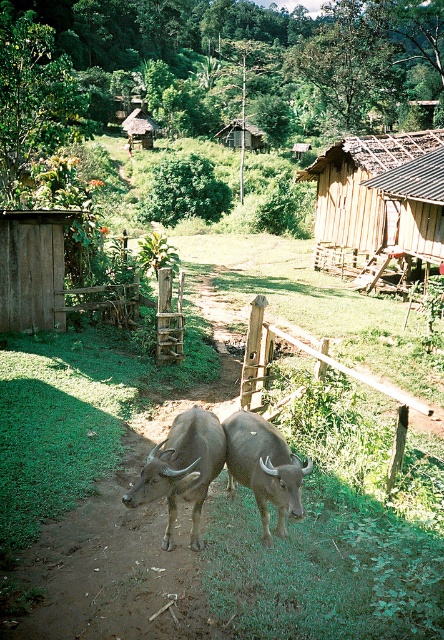
Question: Which of these objects is positioned closest to the dark brown textured cow at center?

Choices:
 (A) wooden hut at center
 (B) wooden hut at upper right

Answer: (B)

Question: Which point is farther to the camera?

Choices:
 (A) brown rough textured buffalo at center
 (B) wooden hut at upper right
 (C) wooden thatched hut at upper center
 (D) wooden fence at center

Answer: (C)

Question: Which point is farther to the camera?

Choices:
 (A) wooden thatched hut at upper center
 (B) wooden fence at left
 (C) dark brown textured cow at center

Answer: (A)

Question: Is wooden hut at upper right positioned behind wooden thatched hut at upper center?

Choices:
 (A) no
 (B) yes

Answer: (A)

Question: Does wooden hut at upper right lie in front of dark brown textured cow at center?

Choices:
 (A) no
 (B) yes

Answer: (A)

Question: Where is wooden hut at upper right located in relation to wooden thatched hut at upper center in the image?

Choices:
 (A) left
 (B) right

Answer: (B)